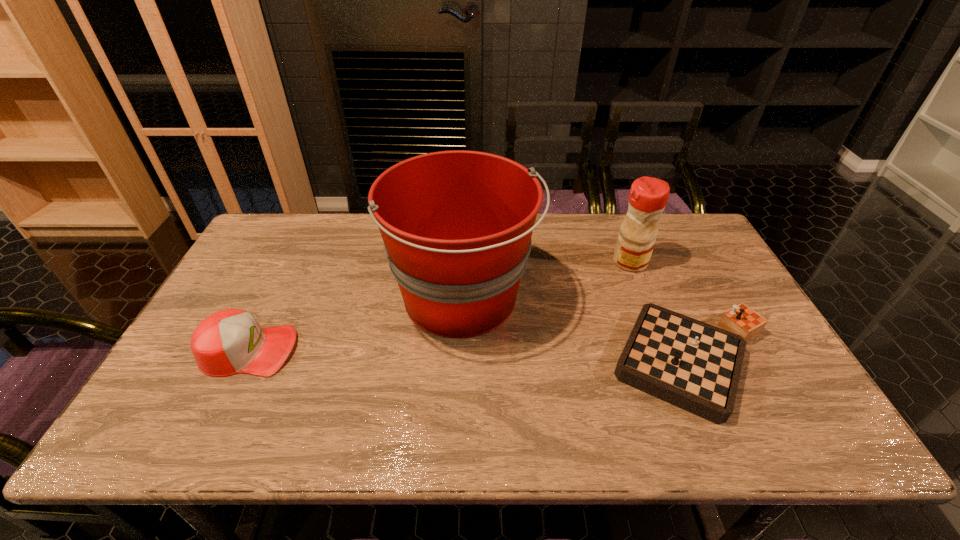
You are a GUI agent. You are given a task and a screenshot of the screen. Output one action in this format:
    pyautogui.click(x=<x>, y=<y>)
    Task: Click on the vacant space at the far right corner of the desktop
    This screenshot has height=540, width=960.
    Given the screenshot: What is the action you would take?
    pyautogui.click(x=663, y=235)

Find the location of `free space between the chessboard and the tallest object`. free space between the chessboard and the tallest object is located at coordinates coord(579,331).

What are the coordinates of `free space between the bucket and the condiment` in the screenshot? It's located at (546, 280).

I want to click on vacant area that lies between the chessboard and the baseball cap, so click(x=472, y=356).

You are a GUI agent. You are given a task and a screenshot of the screen. Output one action in this format:
    pyautogui.click(x=<x>, y=<y>)
    Task: Click on the unoccupied area between the baseball cap and the second object from left to right
    
    Given the screenshot: What is the action you would take?
    pyautogui.click(x=356, y=324)

Where is `free point between the tallest object and the second shortest object`? This screenshot has height=540, width=960. free point between the tallest object and the second shortest object is located at coordinates (356, 324).

Find the location of `free spot between the baseball cap and the bucket`. free spot between the baseball cap and the bucket is located at coordinates (356, 324).

The height and width of the screenshot is (540, 960). I want to click on vacant area that lies between the third object from right to left and the condiment, so click(546, 280).

At what (x,y) coordinates should I click in order to perform the action: click on vacant space that's between the chessboard and the leftmost object. Please return your answer as a coordinate pair (x, y). This screenshot has height=540, width=960. Looking at the image, I should click on (472, 356).

Choose which object is the second nearest neighbor to the third tallest object. Please provide its 2D coordinates. Your answer should be formatted as a tuple, i.e. [(x, y)], where the tuple contains the x and y coordinates of a point satisfying the conditions above.

[(693, 365)]